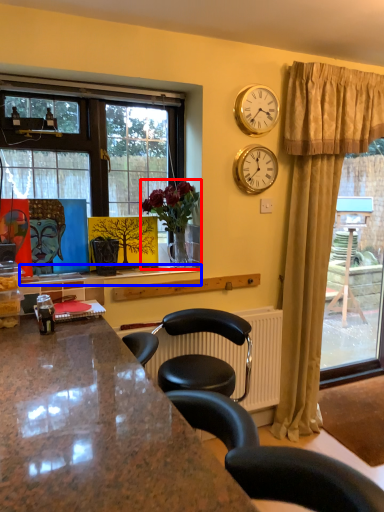
Question: Which point is further to the camera, houseplant (highlighted by a red box) or window sill (highlighted by a blue box)?

Choices:
 (A) houseplant
 (B) window sill

Answer: (A)